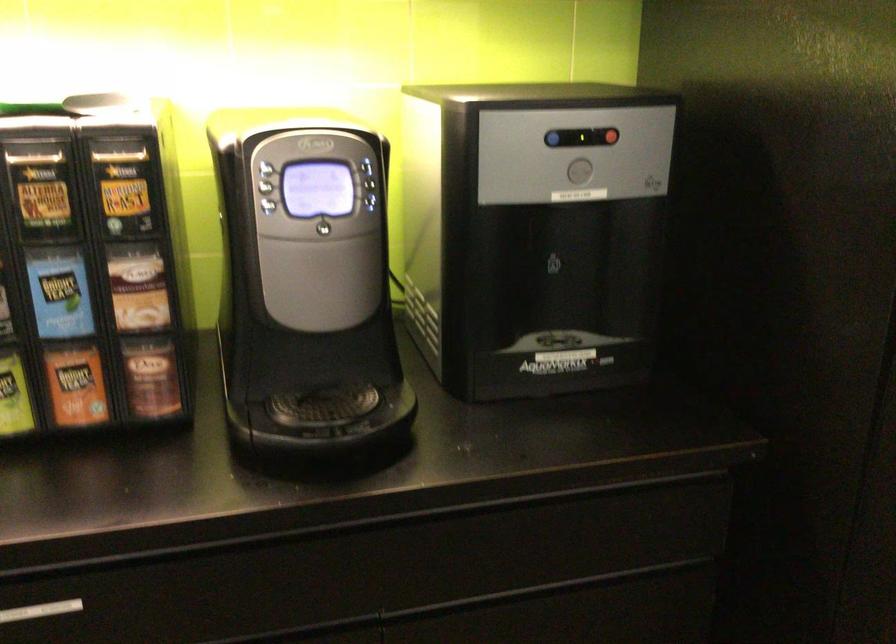
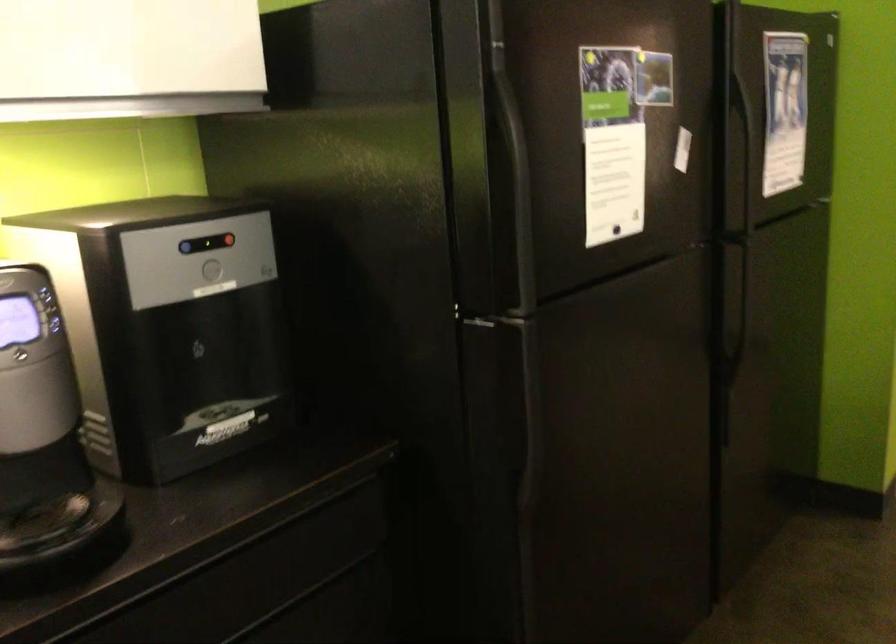
Question: The camera is either moving clockwise (left) or counter-clockwise (right) around the object. The first image is from the beginning of the video and the second image is from the end. Is the camera moving left or right when shooting the video?

Choices:
 (A) Left
 (B) Right

Answer: (A)